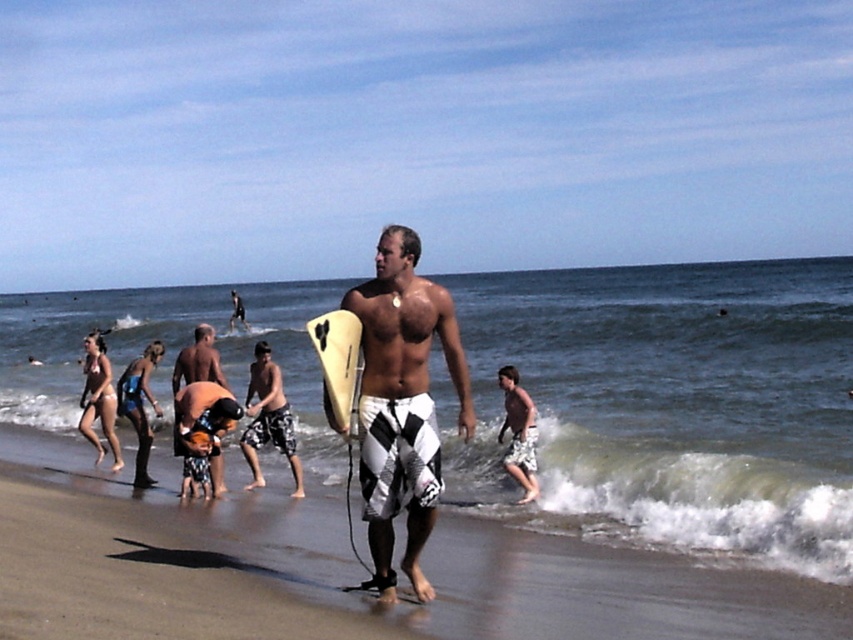
Between white checkered shorts at center and camouflage shorts at center, which one appears on the left side from the viewer's perspective?

camouflage shorts at center

Who is positioned more to the right, white checkered shorts at center or camouflage shorts at center?

white checkered shorts at center is more to the right.

At what (x,y) coordinates should I click in order to perform the action: click on white checkered shorts at center. Please return your answer as a coordinate pair (x, y). This screenshot has width=853, height=640. Looking at the image, I should click on (606, 593).

Based on the photo, is white checkered boardshorts at center further to the viewer compared to camouflage shorts at center?

No.

At what (x,y) coordinates should I click in order to perform the action: click on white checkered boardshorts at center. Please return your answer as a coordinate pair (x, y). This screenshot has height=640, width=853. Looking at the image, I should click on [402, 404].

You are a GUI agent. You are given a task and a screenshot of the screen. Output one action in this format:
    pyautogui.click(x=<x>, y=<y>)
    Task: Click on the white checkered boardshorts at center
    The height and width of the screenshot is (640, 853).
    Given the screenshot: What is the action you would take?
    pyautogui.click(x=402, y=404)

Is yellow foam surfboard at center closer to camera compared to orange fabric bag at center?

Yes, yellow foam surfboard at center is closer to the viewer.

Is point (341, 422) farther from viewer compared to point (212, 349)?

No, it is not.

This screenshot has height=640, width=853. I want to click on yellow foam surfboard at center, so 339,364.

The width and height of the screenshot is (853, 640). Find the location of `yellow foam surfboard at center`. yellow foam surfboard at center is located at coordinates (339, 364).